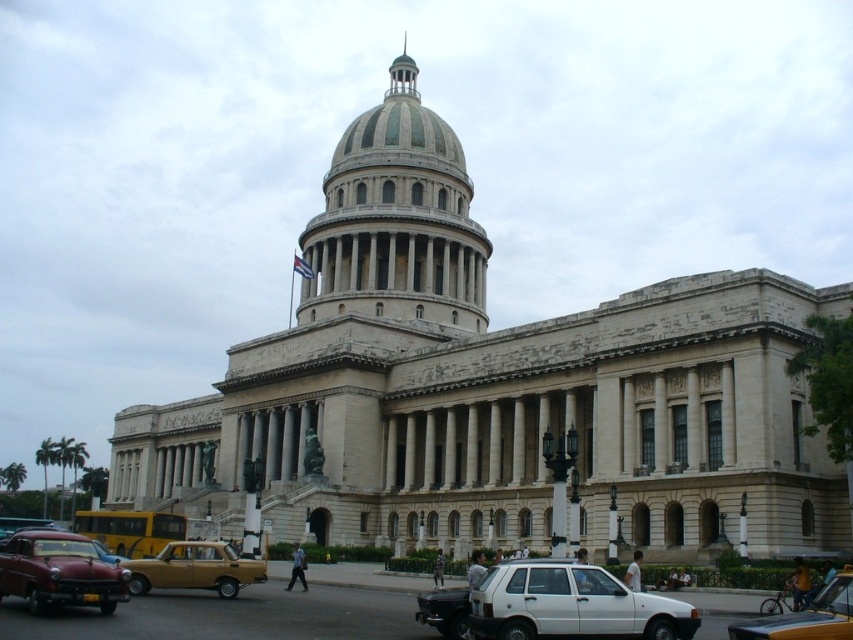
Question: Which of the following is the closest to the observer?

Choices:
 (A) yellow matte taxi at lower right
 (B) white matte car at center
 (C) shiny red car at lower left

Answer: (A)

Question: Which point is closer to the camera?

Choices:
 (A) yellow matte taxi at lower right
 (B) green marble dome at center

Answer: (A)

Question: Considering the relative positions of green marble dome at center and yellow matte taxi at lower left in the image provided, where is green marble dome at center located with respect to yellow matte taxi at lower left?

Choices:
 (A) above
 (B) below

Answer: (A)

Question: Can you confirm if matte yellow taxi at center is thinner than yellow matte taxi at lower left?

Choices:
 (A) yes
 (B) no

Answer: (A)

Question: Is shiny red car at lower left wider than yellow matte taxi at lower left?

Choices:
 (A) no
 (B) yes

Answer: (A)

Question: Estimate the real-world distances between objects in this image. Which object is closer to the yellow matte taxi at lower right?

Choices:
 (A) shiny red car at lower left
 (B) green marble dome at center
 (C) yellow matte taxi at lower left
 (D) white matte car at center

Answer: (D)